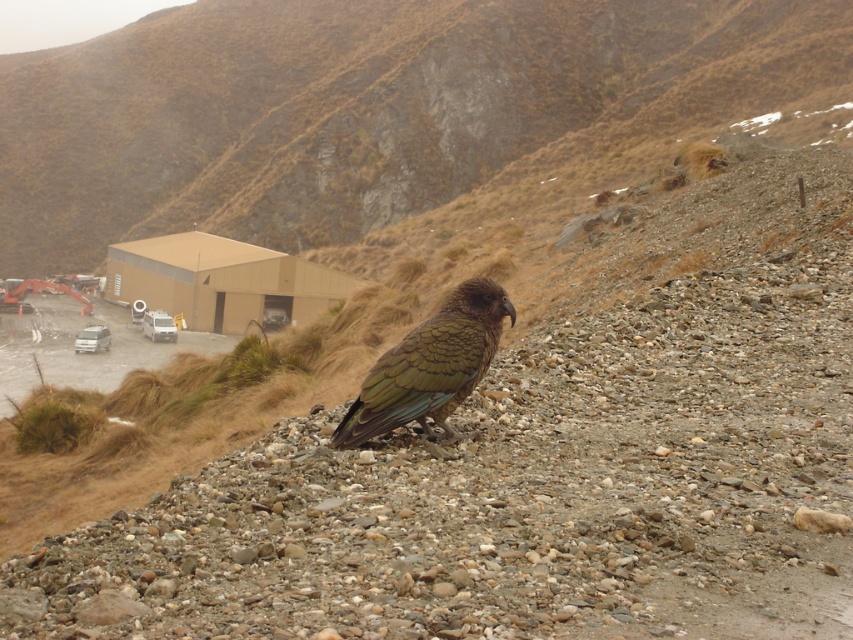
You are planning to build a small garden on the brown grassy hillside at upper center and the green feathered bird at center. Which location would require more soil to cover the existing ground for the garden?

The brown grassy hillside at upper center requires more soil because it is much taller than the green feathered bird at center, meaning the existing ground there is higher and thus needs more soil to level or cover.

You are standing at the point marked as point [364,108] in the rugged mountainous landscape. What type of terrain are you currently standing on?

The point [364,108] is on a brown grassy hillside at upper center, so you are standing on a grassy hillside terrain.